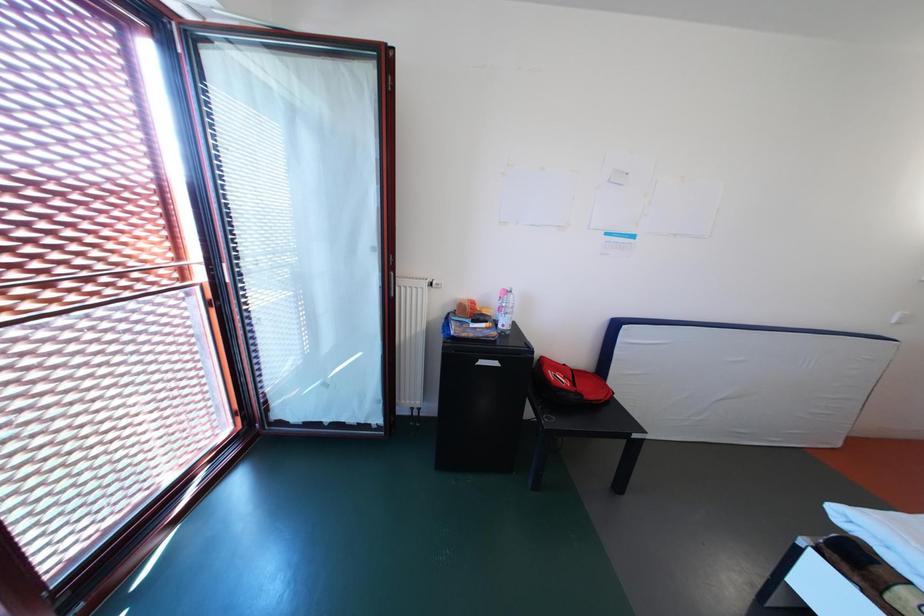
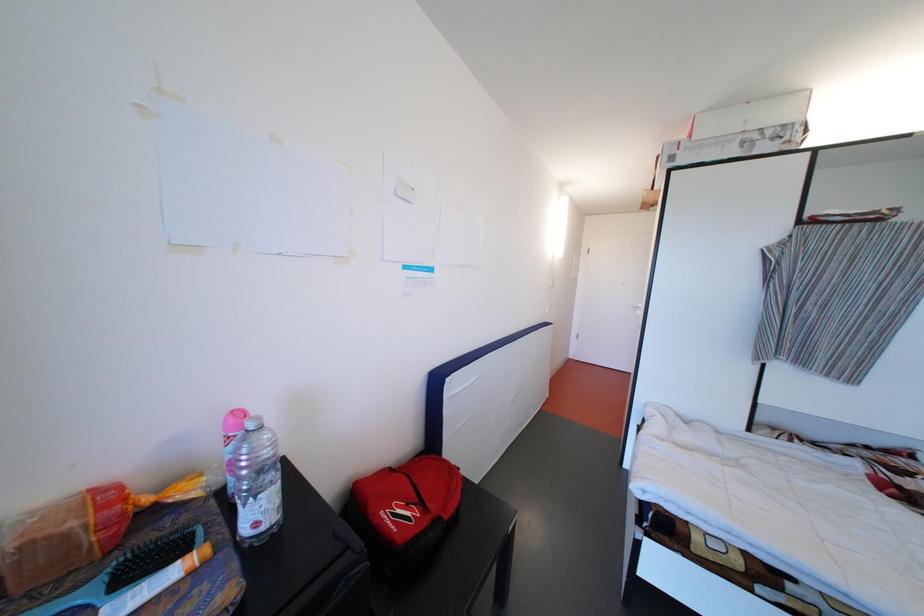
Question: Based on the continuous images, in which direction is the camera rotating? Reply with the corresponding letter.

Choices:
 (A) Left
 (B) Right
 (C) Up
 (D) Down

Answer: (B)